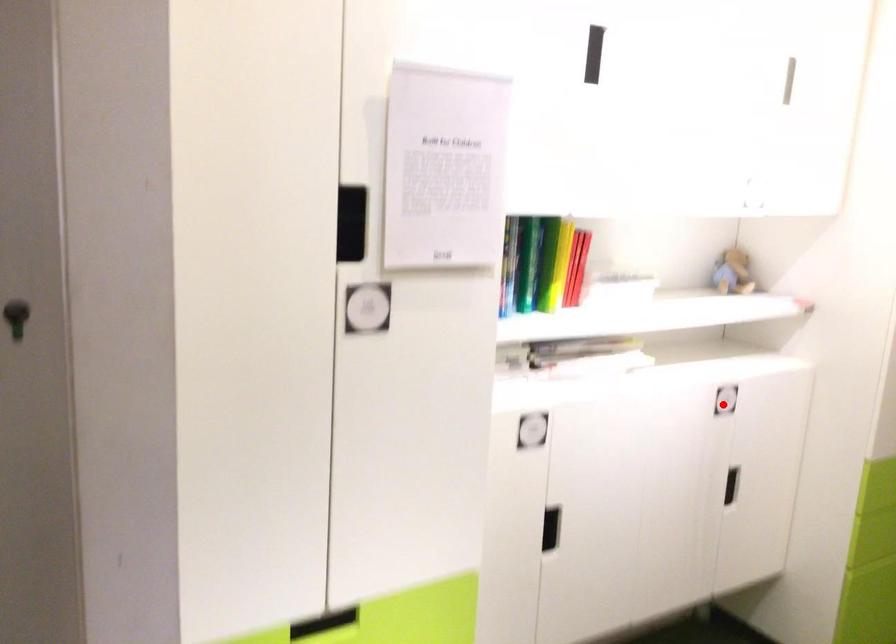
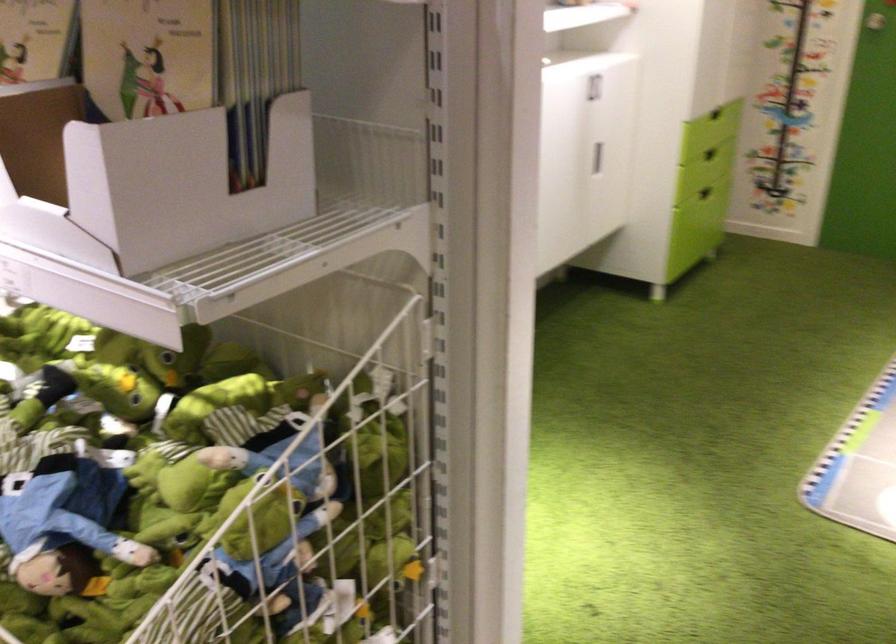
Question: I am providing you with two images of the same scene from different viewpoints. Given a red point in image1, look at the same physical point in image2. Is it:

Choices:
 (A) Closer to the viewpoint
 (B) Farther from the viewpoint

Answer: (B)